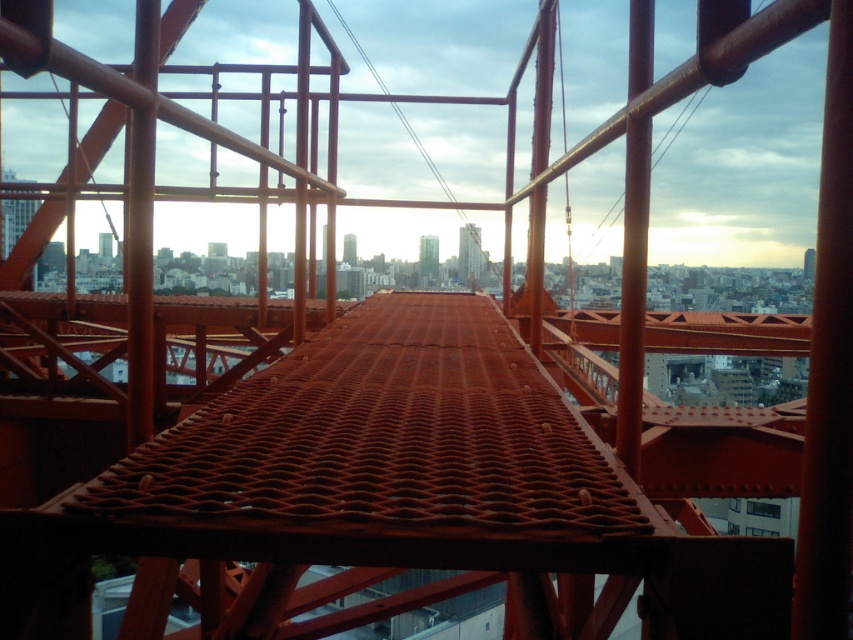
Question: Observing the image, what is the correct spatial positioning of smooth glass skyscraper at center in reference to green glass tower at center?

Choices:
 (A) below
 (B) above

Answer: (B)

Question: Which object appears farthest from the camera in this image?

Choices:
 (A) smooth orange tower at center
 (B) smooth glass skyscraper at center

Answer: (A)

Question: Estimate the real-world distances between objects in this image. Which object is farther from the green glass tower at center?

Choices:
 (A) smooth glass skyscraper at center
 (B) smooth orange tower at center

Answer: (B)

Question: Is smooth glass skyscraper at center smaller than green glass tower at center?

Choices:
 (A) yes
 (B) no

Answer: (B)

Question: Is smooth glass skyscraper at center wider than green glass tower at center?

Choices:
 (A) no
 (B) yes

Answer: (B)

Question: Which of the following is the farthest from the observer?

Choices:
 (A) (347, 257)
 (B) (479, 275)

Answer: (A)